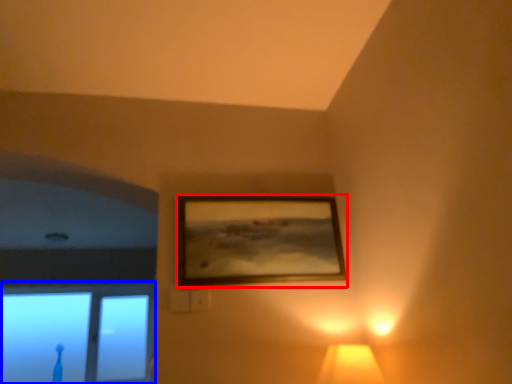
Question: Among these objects, which one is nearest to the camera, picture frame (highlighted by a red box) or window (highlighted by a blue box)?

Choices:
 (A) picture frame
 (B) window

Answer: (A)